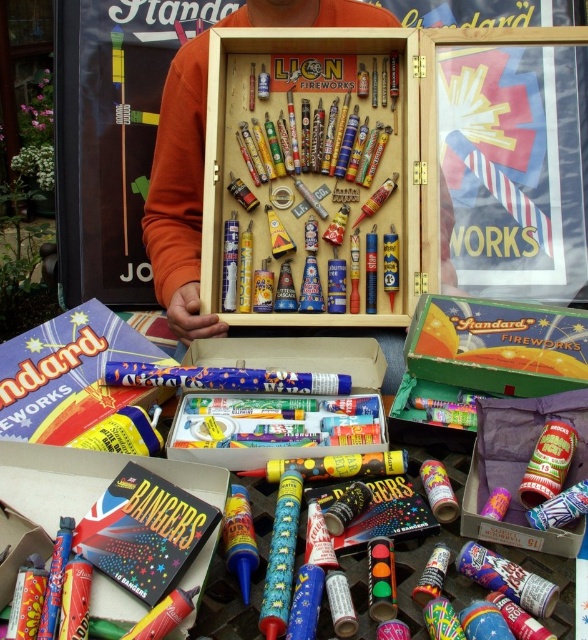
Can you confirm if green cardboard box at center is positioned to the left of matte cardboard box of bangers at center?

No, green cardboard box at center is not to the left of matte cardboard box of bangers at center.

Which is above, green cardboard box at center or matte cardboard box of bangers at center?

green cardboard box at center is higher up.

Is point (442, 380) less distant than point (48, 468)?

That is False.

The height and width of the screenshot is (640, 588). I want to click on green cardboard box at center, so click(497, 346).

Between orange cotton shirt at center and matte cardboard box of bangers at center, which one has less height?

Standing shorter between the two is matte cardboard box of bangers at center.

Which of these two, orange cotton shirt at center or matte cardboard box of bangers at center, stands taller?

Standing taller between the two is orange cotton shirt at center.

What are the coordinates of `orange cotton shirt at center` in the screenshot? It's located at (179, 195).

Image resolution: width=588 pixels, height=640 pixels. What are the coordinates of `orange cotton shirt at center` in the screenshot? It's located at [x=179, y=195].

Which is more to the left, matte cardboard box at lower left or metallic silver canister at center?

Positioned to the left is matte cardboard box at lower left.

Is point (35, 394) in front of point (513, 520)?

No, it is behind (513, 520).

Measure the distance between point [108,308] and camera.

The distance of point [108,308] from camera is 3.38 feet.

Where is `matte cardboard box at lower left`? The width and height of the screenshot is (588, 640). matte cardboard box at lower left is located at coordinates (69, 374).